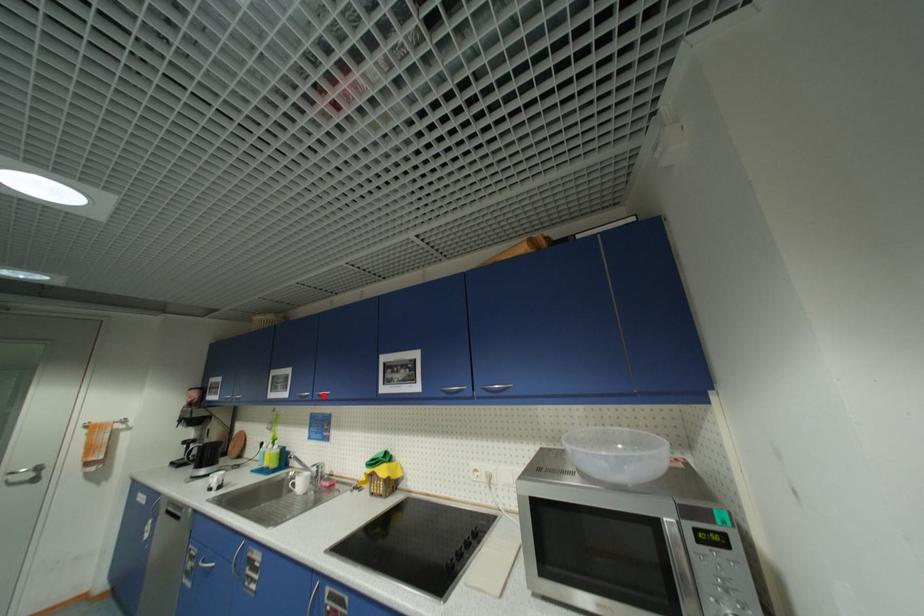
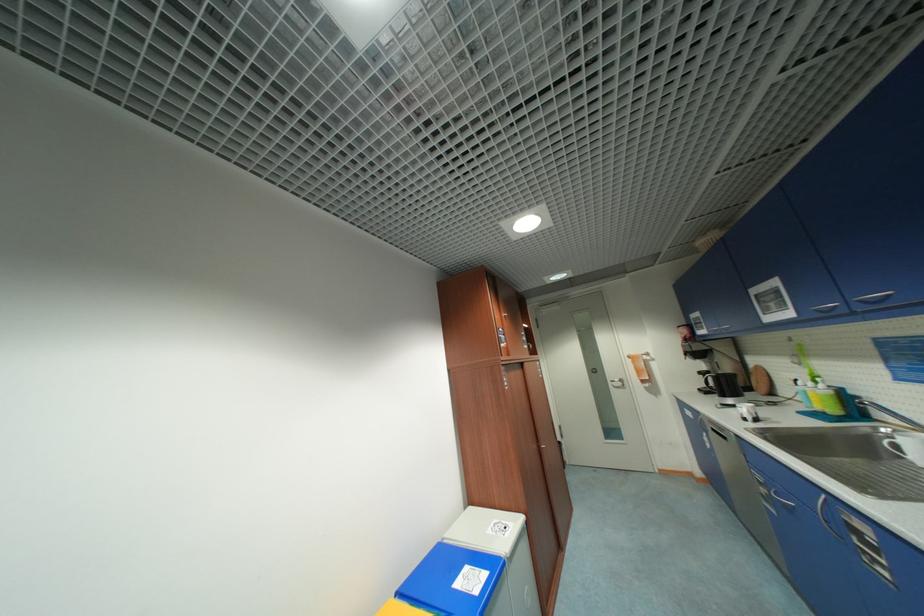
Where in the second image is the point corresponding to the highlighted location from the first image?

(867, 302)